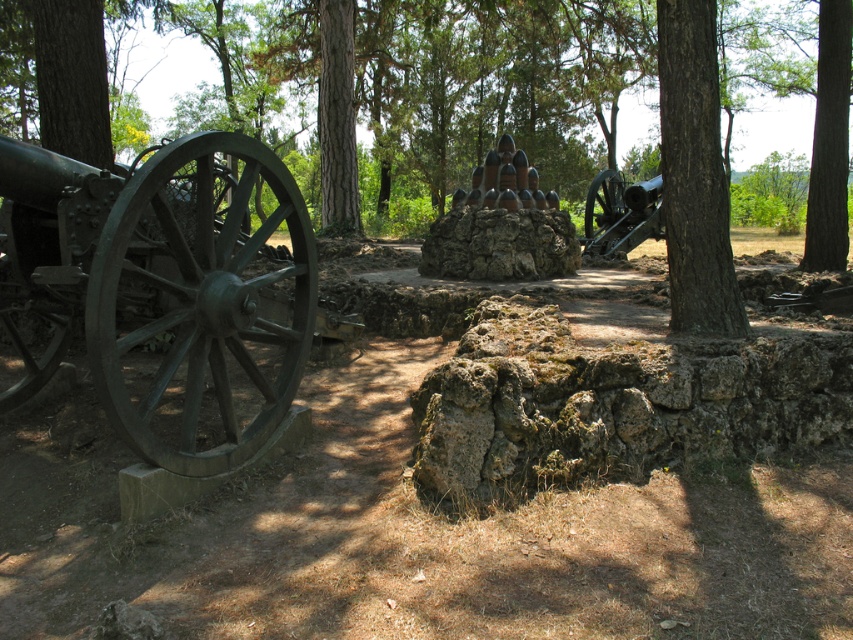
You are a soldier in the Civil War, and you need to hide behind a tree to avoid enemy fire. You have two options in the scene, the brown rough bark tree at right and the green rough bark tree at center. Which tree would provide better cover based on their sizes?

The green rough bark tree at center is taller than the brown rough bark tree at right, so it would provide better cover from enemy fire.

You are a historian examining the battlefield layout. You need to determine which object, the green metal cannon at left or the green rough bark tree at center, has a greater height. Based on the scene, which one is taller?

The green rough bark tree at center is taller than the green metal cannon at left.